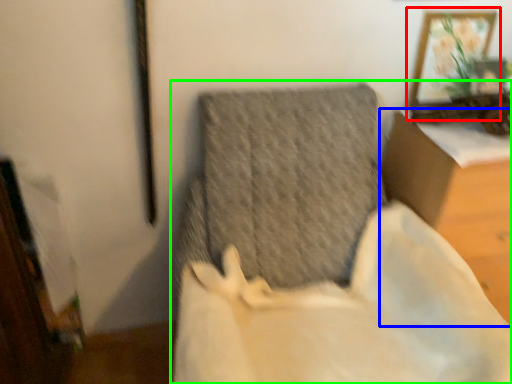
Question: Considering the real-world distances, which object is closest to picture frame (highlighted by a red box)? furniture (highlighted by a blue box) or furniture (highlighted by a green box).

Choices:
 (A) furniture
 (B) furniture

Answer: (A)